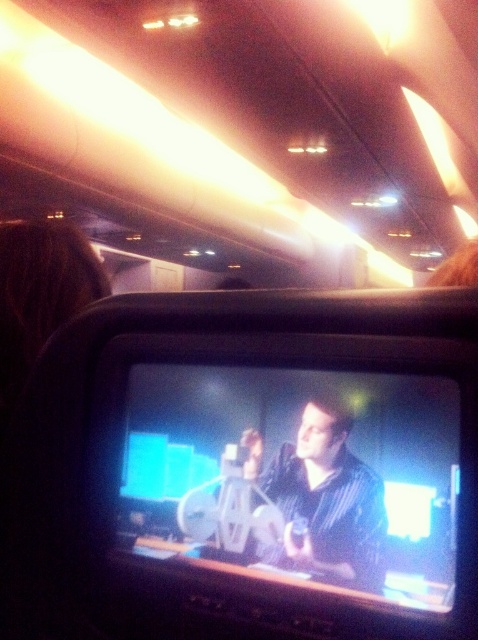
Question: Is the position of matte black monitor at center more distant than that of matte black shirt at center?

Choices:
 (A) no
 (B) yes

Answer: (A)

Question: Which object is farther from the camera taking this photo?

Choices:
 (A) matte black shirt at center
 (B) matte black monitor at center

Answer: (A)

Question: Can you confirm if matte black monitor at center is smaller than matte black shirt at center?

Choices:
 (A) no
 (B) yes

Answer: (A)

Question: Can you confirm if matte black monitor at center is wider than matte black shirt at center?

Choices:
 (A) no
 (B) yes

Answer: (B)

Question: Among these points, which one is farthest from the camera?

Choices:
 (A) (347, 516)
 (B) (411, 467)

Answer: (A)